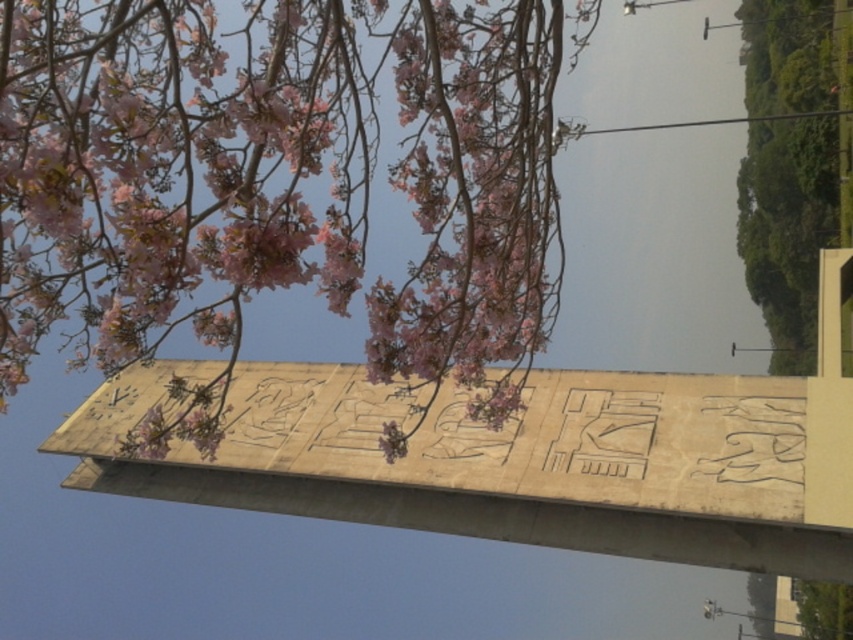
Is pink matte flowers at upper center to the left of green leafy tree at upper right from the viewer's perspective?

Yes, pink matte flowers at upper center is to the left of green leafy tree at upper right.

Which of these two, pink matte flowers at upper center or green leafy tree at upper right, stands taller?

green leafy tree at upper right

Is point (502, 376) closer to camera compared to point (834, 176)?

Yes, it is in front of point (834, 176).

Where is `pink matte flowers at upper center`? The height and width of the screenshot is (640, 853). pink matte flowers at upper center is located at coordinates (280, 186).

Is beige stone obelisk at center positioned before green leafy tree at upper right?

Yes, it is in front of green leafy tree at upper right.

From the picture: Who is more forward, (805, 440) or (761, 124)?

Point (805, 440) is in front.

What do you see at coordinates (509, 461) in the screenshot? The height and width of the screenshot is (640, 853). I see `beige stone obelisk at center` at bounding box center [509, 461].

Where is `beige stone obelisk at center`? beige stone obelisk at center is located at coordinates (509, 461).

Is pink matte flowers at upper center to the right of beige stone obelisk at center from the viewer's perspective?

Incorrect, pink matte flowers at upper center is not on the right side of beige stone obelisk at center.

Locate an element on the screen. pink matte flowers at upper center is located at coordinates (280, 186).

Which is behind, point (352, 161) or point (154, 384)?

Positioned behind is point (154, 384).

Where is `pink matte flowers at upper center`? The width and height of the screenshot is (853, 640). pink matte flowers at upper center is located at coordinates (280, 186).